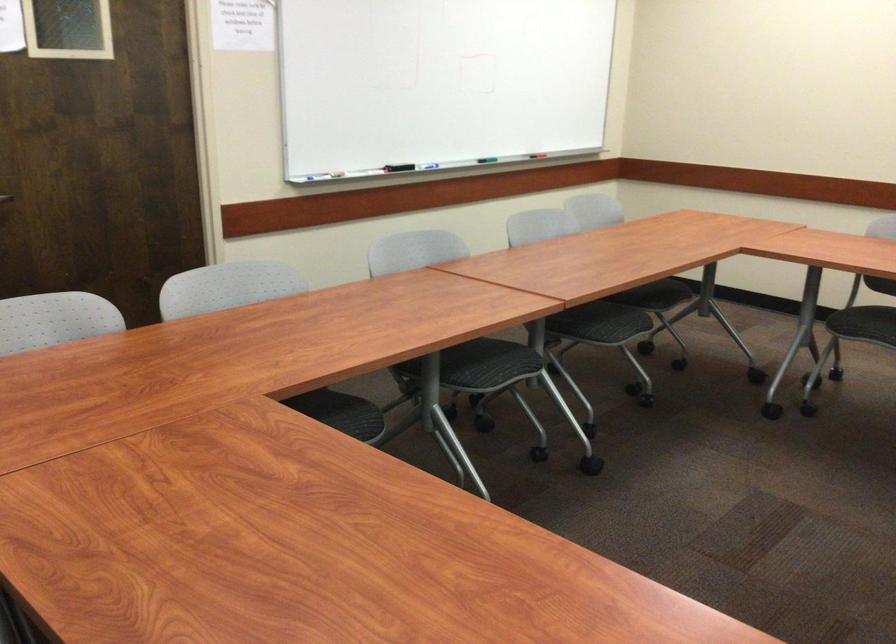
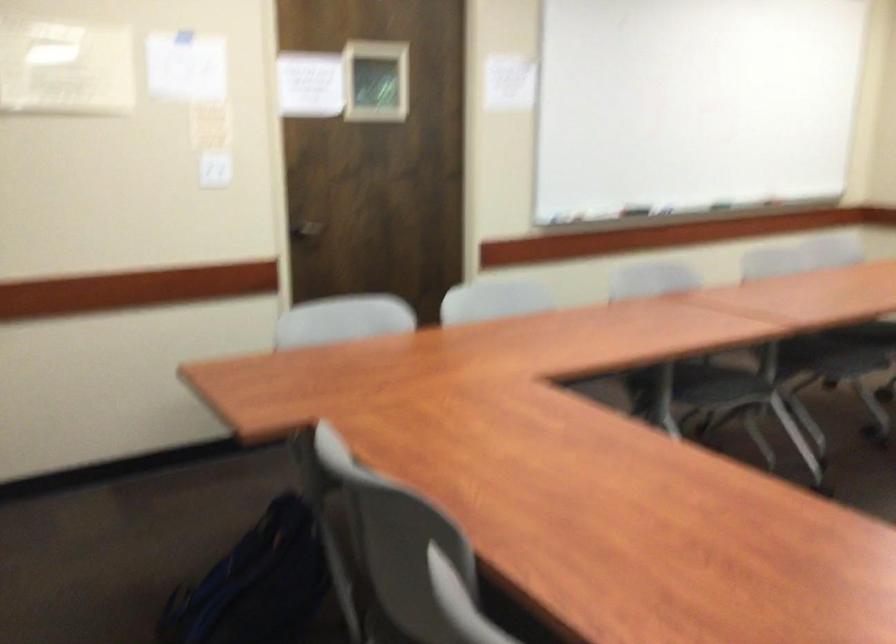
Find the pixel in the second image that matches (613,307) in the first image.

(860, 341)